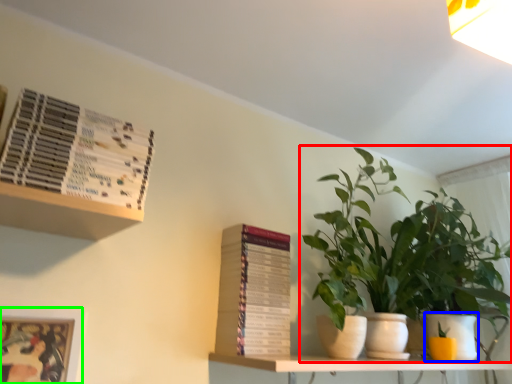
Question: Estimate the real-world distances between objects in this image. Which object is closer to houseplant (highlighted by a red box), flowerpot (highlighted by a blue box) or picture frame (highlighted by a green box)?

Choices:
 (A) flowerpot
 (B) picture frame

Answer: (A)